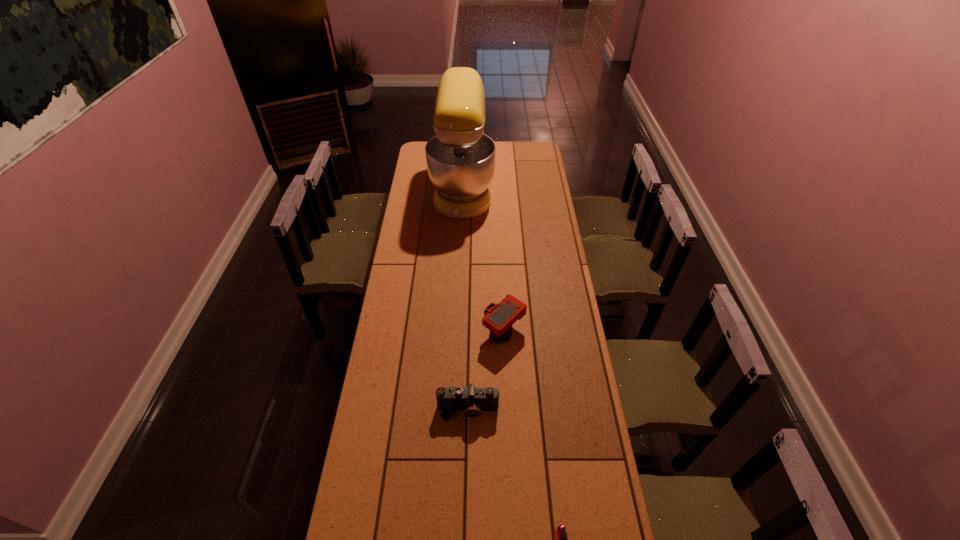
Locate an element on the screen. This screenshot has height=540, width=960. object present at the far left corner is located at coordinates (460, 158).

Where is `free region at the left edge of the desktop`? The width and height of the screenshot is (960, 540). free region at the left edge of the desktop is located at coordinates (416, 309).

Image resolution: width=960 pixels, height=540 pixels. In order to click on vacant space at the right edge of the desktop in this screenshot , I will do `click(573, 308)`.

Image resolution: width=960 pixels, height=540 pixels. I want to click on free space at the far right corner of the desktop, so click(536, 160).

At what (x,y) coordinates should I click in order to perform the action: click on vacant space in between the mixer and the second nearest camera. Please return your answer as a coordinate pair (x, y). The image size is (960, 540). Looking at the image, I should click on (466, 299).

Locate an element on the screen. The image size is (960, 540). free space between the second nearest object and the tallest camera is located at coordinates (486, 370).

The height and width of the screenshot is (540, 960). What are the coordinates of `vacant region between the third farthest object and the third nearest object` in the screenshot? It's located at (486, 370).

I want to click on free space between the third farthest object and the farthest object, so click(466, 299).

The height and width of the screenshot is (540, 960). I want to click on free spot between the tallest object and the third nearest object, so click(483, 260).

Select which object is the third closest to the farthest object. Please provide its 2D coordinates. Your answer should be formatted as a tuple, i.e. [(x, y)], where the tuple contains the x and y coordinates of a point satisfying the conditions above.

[(560, 539)]